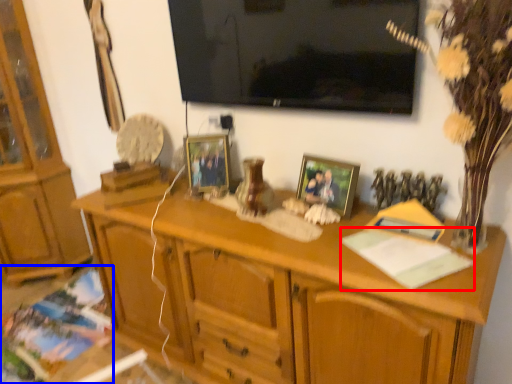
Question: Which object is further to the camera taking this photo, book (highlighted by a red box) or book (highlighted by a blue box)?

Choices:
 (A) book
 (B) book

Answer: (B)